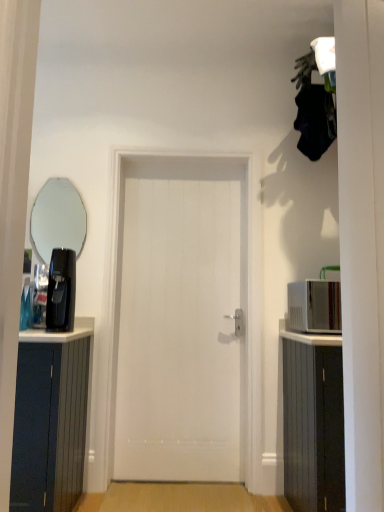
Question: In terms of height, does white wood cabinet at right look taller or shorter compared to white smooth door at center?

Choices:
 (A) short
 (B) tall

Answer: (A)

Question: From the image's perspective, is white wood cabinet at right positioned above or below white smooth door at center?

Choices:
 (A) above
 (B) below

Answer: (B)

Question: Considering the real-world distances, which object is farthest from the white wood cabinet at right?

Choices:
 (A) white smooth door at center
 (B) clear glass mirror at upper left
 (C) black plastic coffee machine at left
 (D) white glossy microwave at right

Answer: (B)

Question: Considering the real-world distances, which object is closest to the black plastic coffee machine at left?

Choices:
 (A) white glossy microwave at right
 (B) white smooth door at center
 (C) white wood cabinet at right
 (D) clear glass mirror at upper left

Answer: (B)